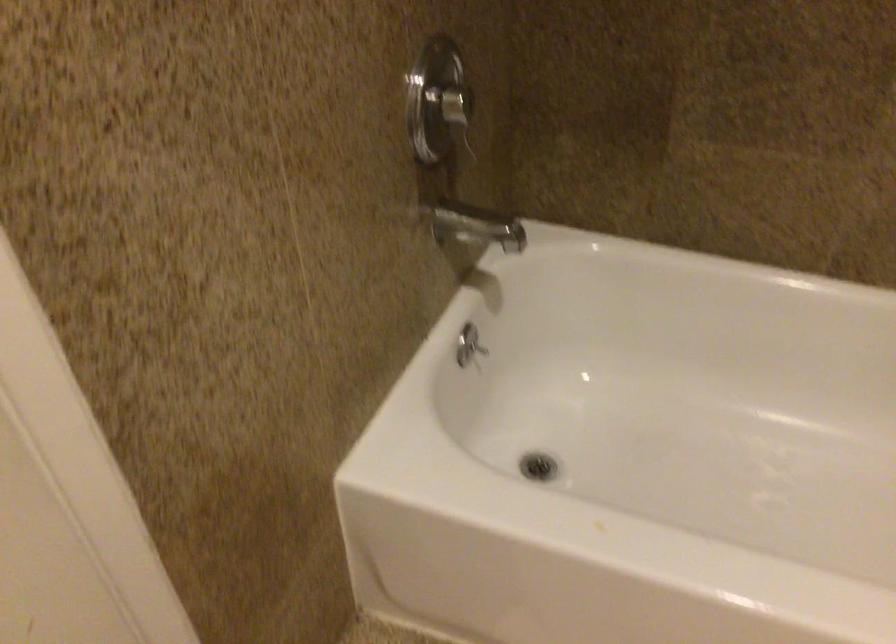
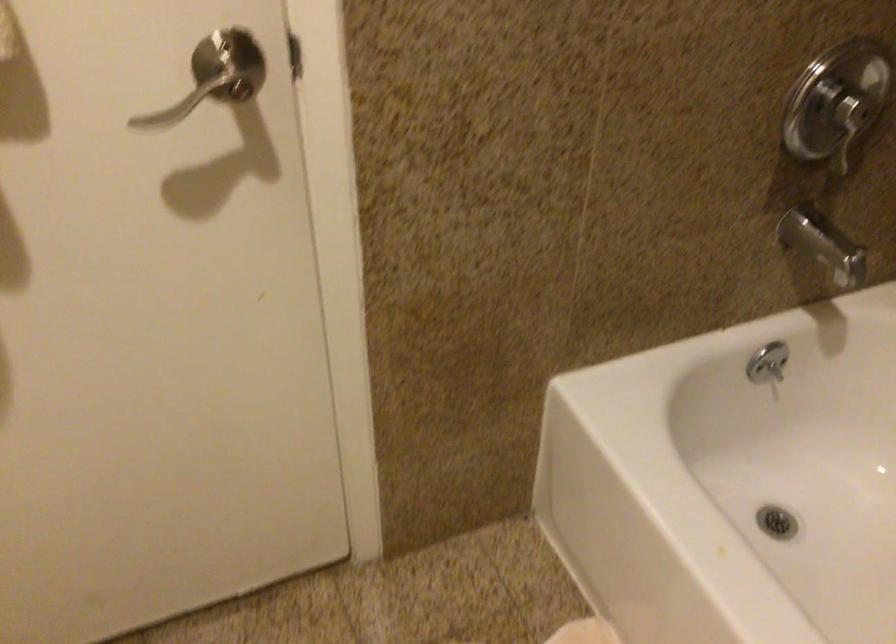
In the second image, find the point that corresponds to point (466, 114) in the first image.

(849, 127)